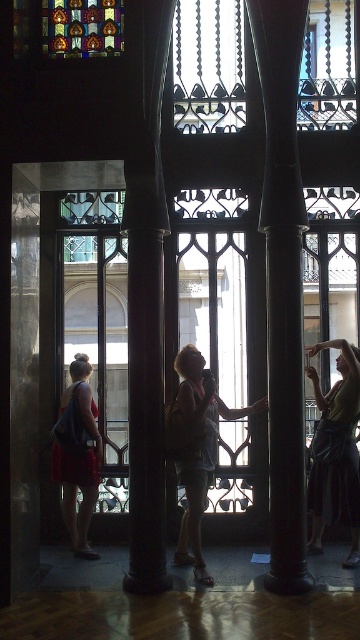
You are an interior designer planning to place a 1.2 meter wide decorative sculpture between the black polished column at center and the dark brown polished wood pillar at center. Given the space between them, will the sculpture fit without touching either column or pillar?

The black polished column at center is wider than the dark brown polished wood pillar at center. However, the description does not provide the exact distance between them, so it is impossible to determine if the sculpture will fit without more information about the spacing.

You are standing in the historic building and want to determine which column is shorter. You see the black polished column at center and the dark brown polished wood pillar at center. Which one is shorter?

The black polished column at center is shorter than the dark brown polished wood pillar at center.

You are a photographer standing in the historic building and want to capture both the matte gray tank top at center and the matte red dress at left in a single frame. Which object should you focus on first to ensure both are in the frame?

You should focus on the matte gray tank top at center first because it is taller than the matte red dress at left, so adjusting the frame to include its height will naturally include the shorter dress as well.